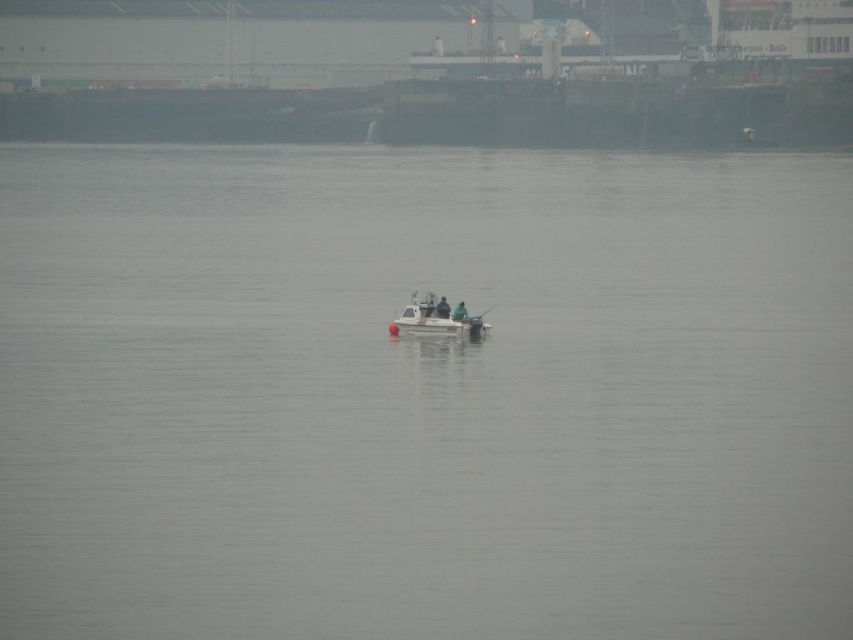
Question: Does white plastic boat at center appear under green matte jacket at center?

Choices:
 (A) yes
 (B) no

Answer: (A)

Question: Is dark blue fabric jacket at center bigger than green matte jacket at center?

Choices:
 (A) yes
 (B) no

Answer: (A)

Question: Which object is farther from the camera taking this photo?

Choices:
 (A) green matte jacket at center
 (B) dark blue fabric jacket at center

Answer: (A)

Question: Which object is farther from the camera taking this photo?

Choices:
 (A) green matte jacket at center
 (B) dark blue fabric jacket at center
 (C) white plastic boat at center

Answer: (A)

Question: Does dark blue fabric jacket at center have a lesser width compared to green matte jacket at center?

Choices:
 (A) yes
 (B) no

Answer: (A)

Question: Which object is positioned farthest from the white plastic boat at center?

Choices:
 (A) dark blue fabric jacket at center
 (B) green matte jacket at center

Answer: (B)